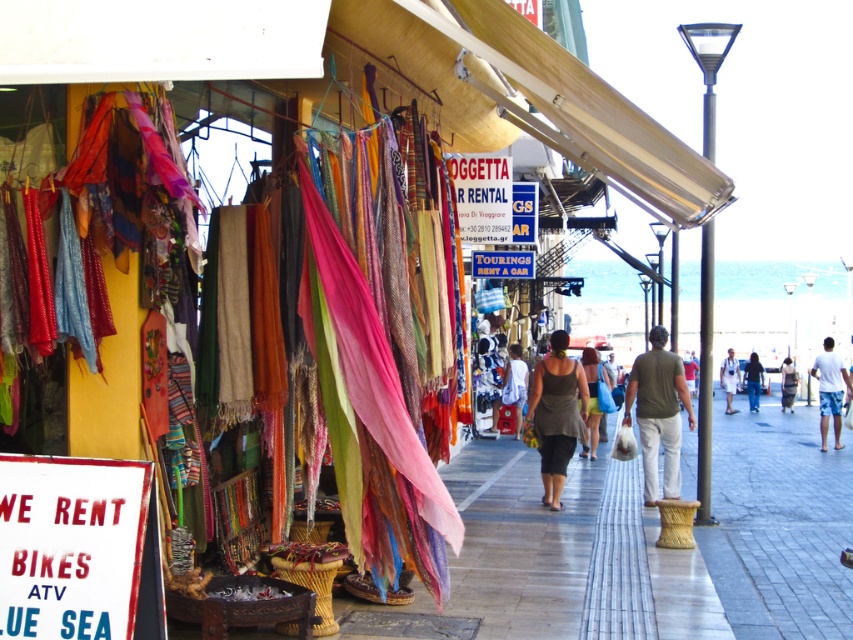
Does white cotton shorts at right have a lesser width compared to denim jeans at center?

Yes, white cotton shorts at right is thinner than denim jeans at center.

Who is taller, white cotton shorts at right or denim jeans at center?

white cotton shorts at right is taller.

Who is more forward, (836, 369) or (763, 380)?

Point (836, 369) is in front.

I want to click on white cotton shorts at right, so click(830, 390).

Is white cotton shorts at right smaller than white cotton shirt at center?

Incorrect, white cotton shorts at right is not smaller in size than white cotton shirt at center.

Can you confirm if white cotton shorts at right is positioned to the left of white cotton shirt at center?

Incorrect, white cotton shorts at right is not on the left side of white cotton shirt at center.

Locate an element on the screen. The height and width of the screenshot is (640, 853). white cotton shorts at right is located at coordinates (830, 390).

Does point (550, 435) lie behind point (752, 392)?

No, it is not.

Find the location of a particular element. Image resolution: width=853 pixels, height=640 pixels. dark gray fabric skirt at center is located at coordinates (556, 413).

Describe the element at coordinates (556, 413) in the screenshot. I see `dark gray fabric skirt at center` at that location.

Identify the location of dark gray fabric skirt at center. The image size is (853, 640). (556, 413).